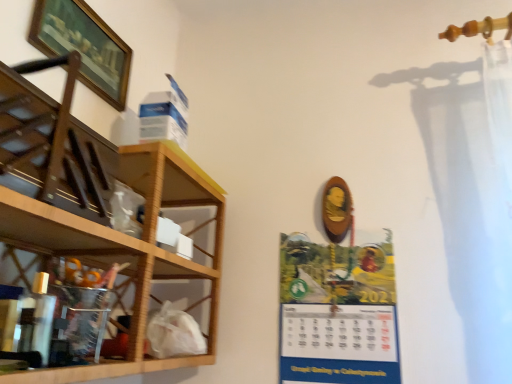
Question: Considering the relative positions of wooden at left and wooden framed picture at upper left in the image provided, is wooden at left to the left of wooden framed picture at upper left from the viewer's perspective?

Choices:
 (A) no
 (B) yes

Answer: (A)

Question: Does wooden at left turn towards wooden framed picture at upper left?

Choices:
 (A) no
 (B) yes

Answer: (A)

Question: Is wooden at left further to camera compared to wooden framed picture at upper left?

Choices:
 (A) no
 (B) yes

Answer: (A)

Question: Is wooden framed picture at upper left surrounded by wooden at left?

Choices:
 (A) yes
 (B) no

Answer: (B)

Question: Does wooden at left appear on the right side of wooden framed picture at upper left?

Choices:
 (A) yes
 (B) no

Answer: (A)

Question: In terms of height, does matte paper calendar at center-right look taller or shorter compared to wooden framed picture at upper left?

Choices:
 (A) tall
 (B) short

Answer: (A)

Question: Is matte paper calendar at center-right spatially inside wooden framed picture at upper left, or outside of it?

Choices:
 (A) outside
 (B) inside

Answer: (A)

Question: From the image's perspective, is matte paper calendar at center-right above or below wooden framed picture at upper left?

Choices:
 (A) below
 (B) above

Answer: (A)

Question: In terms of width, does matte paper calendar at center-right look wider or thinner when compared to wooden framed picture at upper left?

Choices:
 (A) thin
 (B) wide

Answer: (A)

Question: Considering the positions of wooden at left and translucent plastic cabinet at left in the image, is wooden at left bigger or smaller than translucent plastic cabinet at left?

Choices:
 (A) small
 (B) big

Answer: (B)

Question: Considering the positions of wooden at left and translucent plastic cabinet at left in the image, is wooden at left taller or shorter than translucent plastic cabinet at left?

Choices:
 (A) tall
 (B) short

Answer: (A)

Question: Is wooden at left inside the boundaries of translucent plastic cabinet at left, or outside?

Choices:
 (A) outside
 (B) inside

Answer: (A)

Question: Visually, is wooden at left positioned to the left or to the right of translucent plastic cabinet at left?

Choices:
 (A) right
 (B) left

Answer: (A)

Question: Is matte paper calendar at center-right bigger or smaller than translucent plastic cabinet at left?

Choices:
 (A) small
 (B) big

Answer: (A)

Question: In terms of height, does matte paper calendar at center-right look taller or shorter compared to translucent plastic cabinet at left?

Choices:
 (A) tall
 (B) short

Answer: (A)